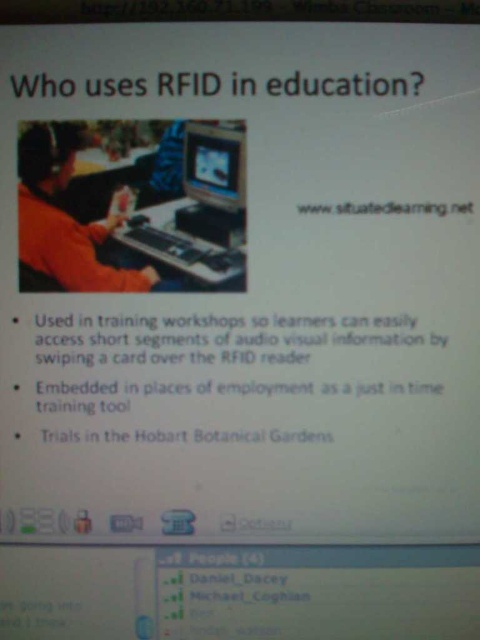
Question: Among these points, which one is nearest to the camera?

Choices:
 (A) (244, 148)
 (B) (116, 269)

Answer: (A)

Question: Among these objects, which one is farthest from the camera?

Choices:
 (A) matte black monitor at center
 (B) orange fabric shirt at left

Answer: (A)

Question: Is orange fabric shirt at left wider than matte black monitor at center?

Choices:
 (A) yes
 (B) no

Answer: (A)

Question: Can you confirm if orange fabric shirt at left is positioned below matte black monitor at center?

Choices:
 (A) no
 (B) yes

Answer: (B)

Question: Does orange fabric shirt at left have a smaller size compared to matte black monitor at center?

Choices:
 (A) yes
 (B) no

Answer: (B)

Question: Among these points, which one is nearest to the camera?

Choices:
 (A) (31, 161)
 (B) (239, 186)

Answer: (A)